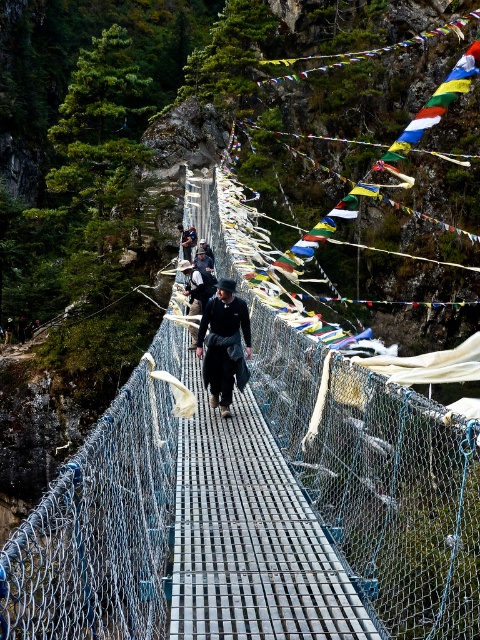
Question: Which object is closer to the camera taking this photo?

Choices:
 (A) blue mesh bridge at center
 (B) black matte jacket at center

Answer: (A)

Question: Does blue mesh bridge at center have a larger size compared to black matte jacket at center?

Choices:
 (A) yes
 (B) no

Answer: (A)

Question: Does blue mesh bridge at center appear on the left side of black matte jacket at center?

Choices:
 (A) no
 (B) yes

Answer: (A)

Question: Which point is closer to the camera taking this photo?

Choices:
 (A) (204, 308)
 (B) (172, 353)

Answer: (B)

Question: Can you confirm if blue mesh bridge at center is bigger than black matte jacket at center?

Choices:
 (A) yes
 (B) no

Answer: (A)